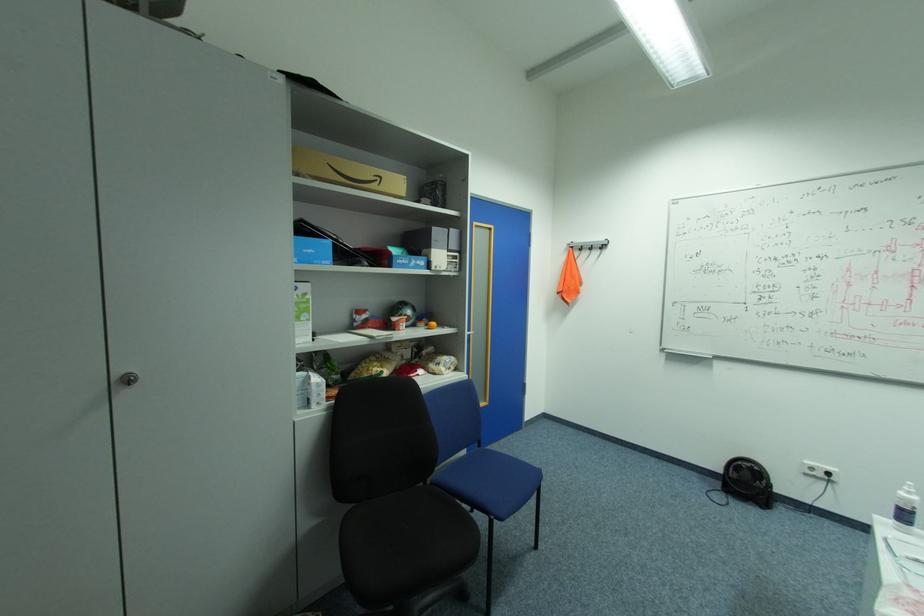
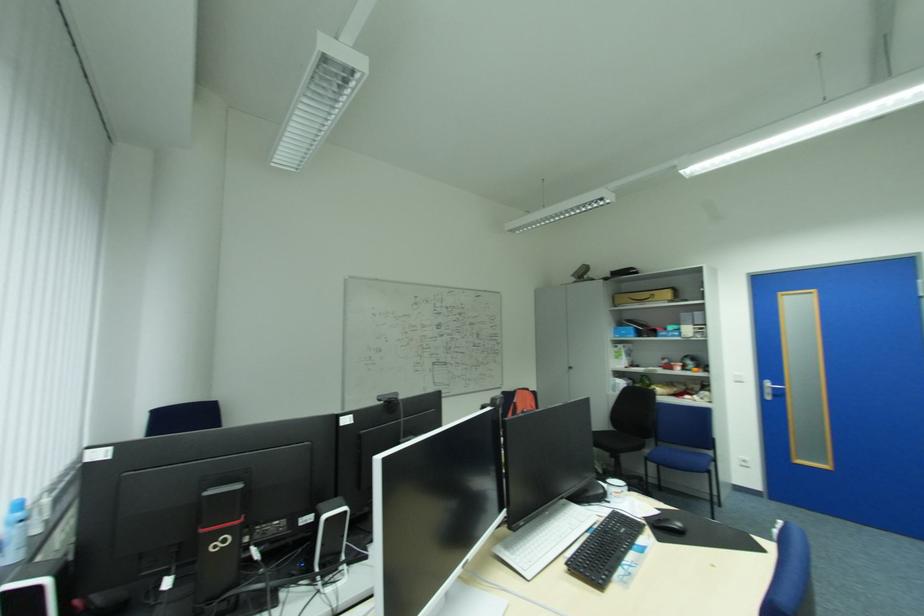
In the second image, find the point that corresponds to point (386, 177) in the first image.

(659, 294)